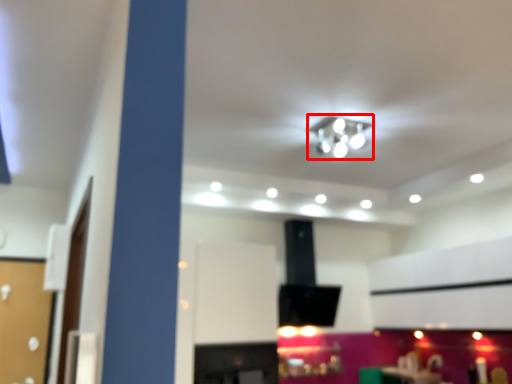
Question: From the image's perspective, what is the correct spatial positioning of lamp (annotated by the red box) in reference to table?

Choices:
 (A) above
 (B) below

Answer: (A)